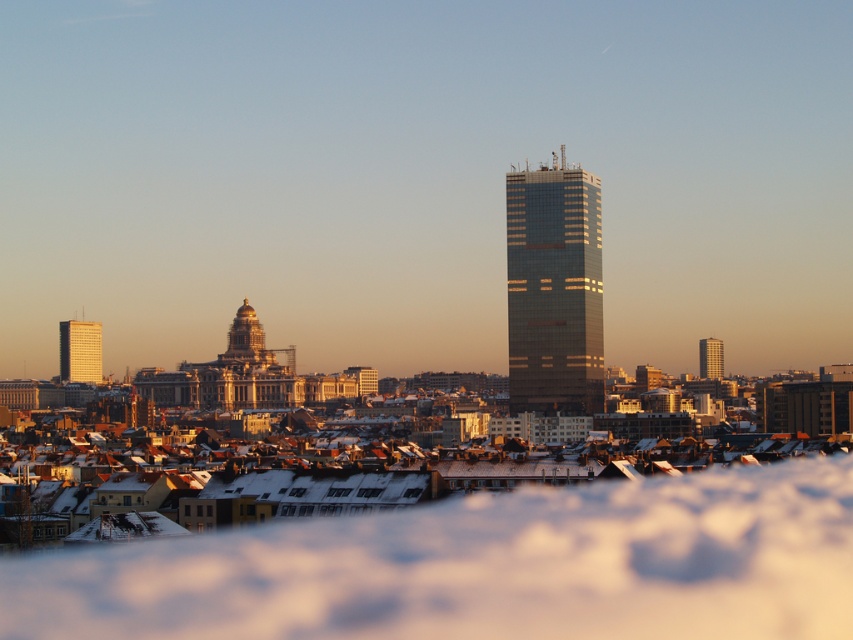
Which of these two, gold dome at center or metallic glass tower at right, stands shorter?

Standing shorter between the two is metallic glass tower at right.

Is gold dome at center taller than metallic glass tower at right?

Yes, gold dome at center is taller than metallic glass tower at right.

Is point (228, 358) less distant than point (712, 339)?

Yes, point (228, 358) is in front of point (712, 339).

The image size is (853, 640). I want to click on gold dome at center, so click(247, 339).

Is point (584, 304) closer to viewer compared to point (254, 336)?

No, (584, 304) is behind (254, 336).

Does glassy metallic skyscraper at center appear on the left side of gold dome at center?

Incorrect, glassy metallic skyscraper at center is not on the left side of gold dome at center.

The width and height of the screenshot is (853, 640). Find the location of `glassy metallic skyscraper at center`. glassy metallic skyscraper at center is located at coordinates (554, 289).

Which is behind, point (80, 371) or point (236, 308)?

The point (80, 371) is behind.

Who is more forward, (90, 326) or (230, 340)?

Positioned in front is point (230, 340).

At what (x,y) coordinates should I click in order to perform the action: click on gold reflective tower at left. Please return your answer as a coordinate pair (x, y). Image resolution: width=853 pixels, height=640 pixels. Looking at the image, I should click on 79,352.